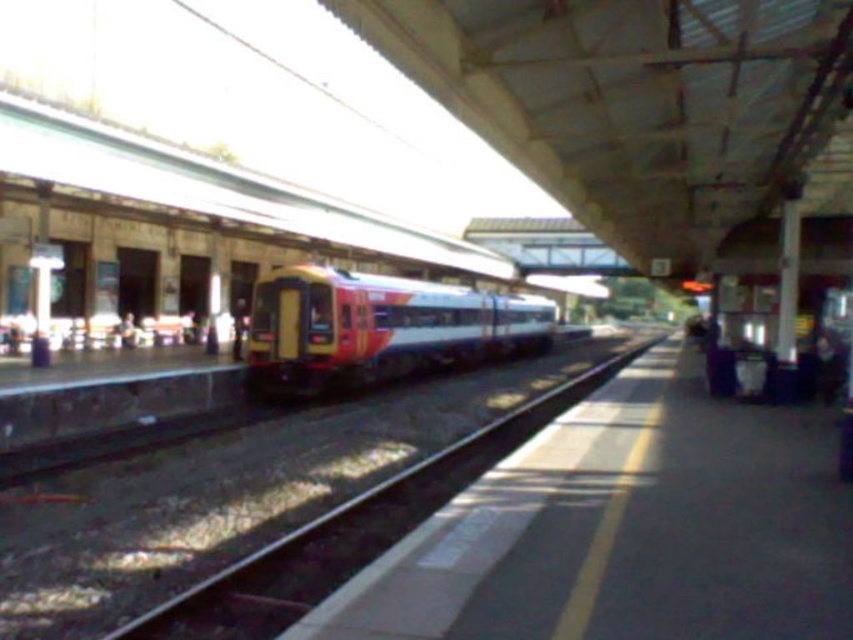
Question: Does yellow and red plastic train at center have a smaller size compared to smooth metal track at center?

Choices:
 (A) yes
 (B) no

Answer: (B)

Question: Which of the following is the closest to the observer?

Choices:
 (A) smooth metal track at center
 (B) yellow and red plastic train at center

Answer: (A)

Question: Does yellow and red plastic train at center appear on the left side of smooth metal track at center?

Choices:
 (A) no
 (B) yes

Answer: (B)

Question: Is yellow and red plastic train at center in front of smooth metal track at center?

Choices:
 (A) yes
 (B) no

Answer: (B)